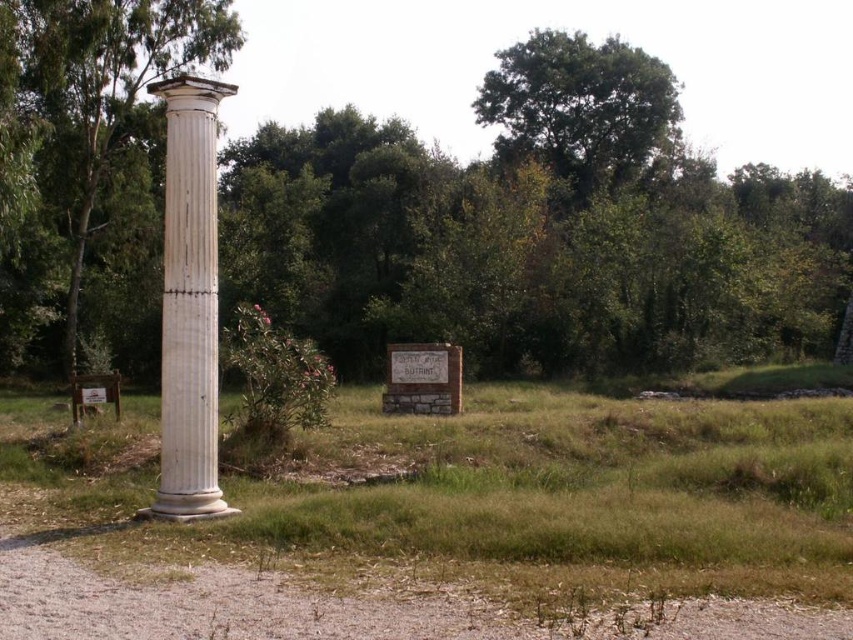
Question: Can you confirm if white marble column at left is bigger than white smooth column at left?

Choices:
 (A) no
 (B) yes

Answer: (A)

Question: Is white marble column at left wider than white smooth column at left?

Choices:
 (A) no
 (B) yes

Answer: (B)

Question: Which point is farther to the camera?

Choices:
 (A) white smooth column at left
 (B) green leafy tree at upper center

Answer: (B)

Question: Can you confirm if white marble column at left is positioned to the left of white marble column at center?

Choices:
 (A) yes
 (B) no

Answer: (B)

Question: Estimate the real-world distances between objects in this image. Which object is closer to the green leafy tree at upper center?

Choices:
 (A) white smooth column at left
 (B) white marble column at left
 (C) white marble column at center

Answer: (A)

Question: Which point appears closest to the camera in this image?

Choices:
 (A) (181, 358)
 (B) (491, 387)
 (C) (529, 148)

Answer: (A)